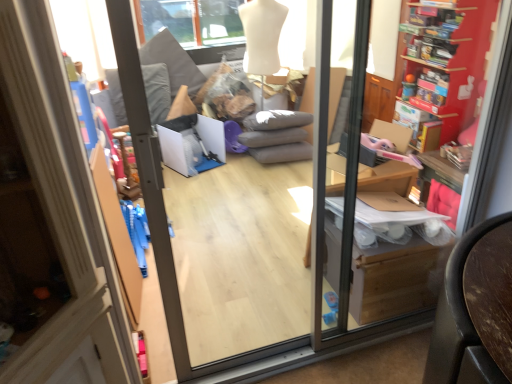
What do you see at coordinates (395, 279) in the screenshot?
I see `matte cardboard box at right` at bounding box center [395, 279].

What do you see at coordinates (447, 60) in the screenshot? This screenshot has width=512, height=384. I see `wooden bookshelf at right` at bounding box center [447, 60].

Where is `matte cardboard box at right`? This screenshot has width=512, height=384. matte cardboard box at right is located at coordinates (395, 279).

Locate an element on the screen. screen door located above the wooden bookshelf at right (from a real-world perspective) is located at coordinates (234, 250).

Is transparent glass screen door at center not close to wooden bookshelf at right?

transparent glass screen door at center is far away from wooden bookshelf at right.

Looking at this image, could wooden bookshelf at right be considered to be inside transparent glass screen door at center?

No.

Is the position of transparent glass screen door at center less distant than that of wooden bookshelf at right?

Yes, transparent glass screen door at center is closer to the viewer.

From the image's perspective, would you say matte cardboard box at right is positioned over wooden bookshelf at right?

No, from the image's perspective, matte cardboard box at right is not over wooden bookshelf at right.

Which is in front, point (354, 287) or point (465, 58)?

Positioned in front is point (354, 287).

Is matte cardboard box at right located outside wooden bookshelf at right?

Yes.

Would you say matte cardboard box at right is a long distance from wooden bookshelf at right?

Indeed, matte cardboard box at right is not near wooden bookshelf at right.

Between transparent glass screen door at center and matte cardboard box at right, which one appears on the right side from the viewer's perspective?

matte cardboard box at right is more to the right.

From a real-world perspective, between transparent glass screen door at center and matte cardboard box at right, who is vertically higher?

transparent glass screen door at center, from a real-world perspective.

Is transparent glass screen door at center with matte cardboard box at right?

No, transparent glass screen door at center is not touching matte cardboard box at right.

How distant is transparent glass screen door at center from matte cardboard box at right?

A distance of 28.52 inches exists between transparent glass screen door at center and matte cardboard box at right.

Measure the distance between wooden bookshelf at right and matte cardboard box at right.

The distance of wooden bookshelf at right from matte cardboard box at right is 4.43 feet.

From the image's perspective, does wooden bookshelf at right appear higher than matte cardboard box at right?

Yes.

From a real-world perspective, which is physically below, wooden bookshelf at right or matte cardboard box at right?

matte cardboard box at right, from a real-world perspective.

Which of these two, wooden bookshelf at right or matte cardboard box at right, stands shorter?

matte cardboard box at right is shorter.

Would you say wooden bookshelf at right is a long distance from transparent glass screen door at center?

That's right, there is a large distance between wooden bookshelf at right and transparent glass screen door at center.

Measure the distance from wooden bookshelf at right to transparent glass screen door at center.

wooden bookshelf at right is 4.62 feet away from transparent glass screen door at center.

In terms of size, does wooden bookshelf at right appear bigger or smaller than transparent glass screen door at center?

Considering their sizes, wooden bookshelf at right takes up more space than transparent glass screen door at center.

From the image's perspective, which object appears higher, matte cardboard box at right or transparent glass screen door at center?

transparent glass screen door at center is shown above in the image.

What's the angular difference between matte cardboard box at right and transparent glass screen door at center's facing directions?

There is a 177-degree angle between the facing directions of matte cardboard box at right and transparent glass screen door at center.

Is point (393, 266) behind point (289, 137)?

No, it is in front of (289, 137).

Is the depth of matte cardboard box at right less than that of transparent glass screen door at center?

No, matte cardboard box at right is further to the viewer.

This screenshot has width=512, height=384. Find the location of `screen door below the wooden bookshelf at right (from the image's perspective)`. screen door below the wooden bookshelf at right (from the image's perspective) is located at coordinates (234, 250).

The image size is (512, 384). In order to click on shelf located on the right of matte cardboard box at right in this screenshot , I will do `click(447, 60)`.

Estimate the real-world distances between objects in this image. Which object is closer to wooden bookshelf at right, matte cardboard box at right or transparent glass screen door at center?

matte cardboard box at right.

Considering their positions, is transparent glass screen door at center positioned closer to matte cardboard box at right than wooden bookshelf at right?

Based on the image, transparent glass screen door at center appears to be nearer to matte cardboard box at right.

When comparing their distances from transparent glass screen door at center, does wooden bookshelf at right or matte cardboard box at right seem further?

wooden bookshelf at right is positioned further to the anchor transparent glass screen door at center.

Considering their positions, is wooden bookshelf at right positioned closer to matte cardboard box at right than transparent glass screen door at center?

The object closer to matte cardboard box at right is transparent glass screen door at center.

When comparing their distances from wooden bookshelf at right, does transparent glass screen door at center or matte cardboard box at right seem further?

transparent glass screen door at center is further to wooden bookshelf at right.

When comparing their distances from transparent glass screen door at center, does matte cardboard box at right or wooden bookshelf at right seem further?

wooden bookshelf at right lies further to transparent glass screen door at center than the other object.

Identify the location of cardboard box between transparent glass screen door at center and wooden bookshelf at right in the front-back direction. (395, 279).